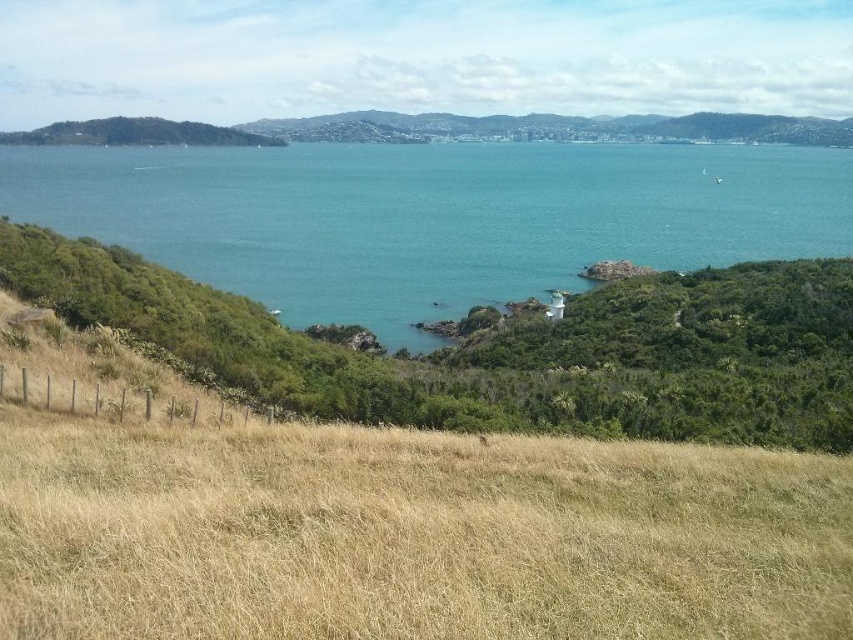
Is the position of blue water at center more distant than that of green grassy hillside at upper left?

No.

This screenshot has height=640, width=853. What are the coordinates of `blue water at center` in the screenshot? It's located at (431, 218).